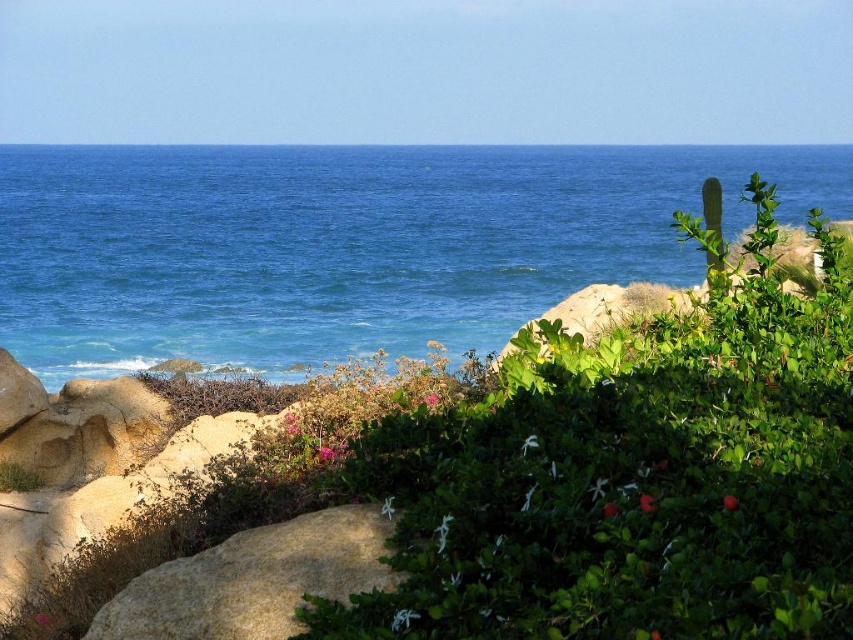
Who is positioned more to the right, green leafy bush at center or smooth beige rock at lower left?

From the viewer's perspective, green leafy bush at center appears more on the right side.

Can you confirm if green leafy bush at center is bigger than smooth beige rock at lower left?

Yes.

Describe the element at coordinates (631, 477) in the screenshot. I see `green leafy bush at center` at that location.

This screenshot has width=853, height=640. Identify the location of green leafy bush at center. (631, 477).

Who is positioned more to the left, blue liquid water at upper center or smooth beige rock at lower left?

From the viewer's perspective, blue liquid water at upper center appears more on the left side.

Is blue liquid water at upper center smaller than smooth beige rock at lower left?

No, blue liquid water at upper center is not smaller than smooth beige rock at lower left.

Who is more forward, (427, 284) or (224, 540)?

Point (224, 540) is more forward.

Where is `blue liquid water at upper center`? This screenshot has width=853, height=640. blue liquid water at upper center is located at coordinates (346, 243).

Which is in front, point (579, 428) or point (74, 259)?

Positioned in front is point (579, 428).

Is green leafy bush at center taller than blue liquid water at upper center?

No.

Is point (689, 488) positioned behind point (267, 339)?

No, it is not.

Find the location of `green leafy bush at center`. green leafy bush at center is located at coordinates coord(631,477).